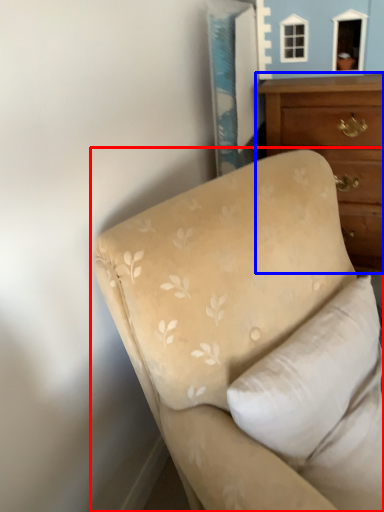
Question: Which of the following is the closest to the observer, studio couch (highlighted by a red box) or chest of drawers (highlighted by a blue box)?

Choices:
 (A) studio couch
 (B) chest of drawers

Answer: (A)